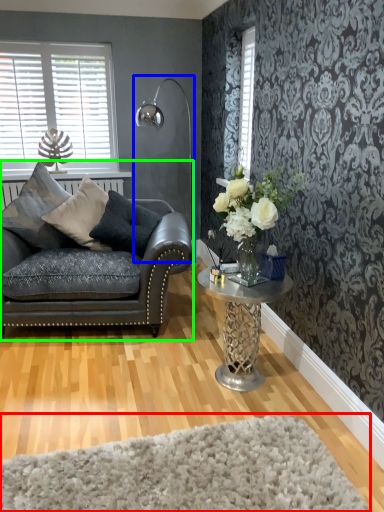
Question: Based on their relative distances, which object is nearer to plain (highlighted by a red box)? Choose from lamp (highlighted by a blue box) and studio couch (highlighted by a green box).

Choices:
 (A) lamp
 (B) studio couch

Answer: (B)